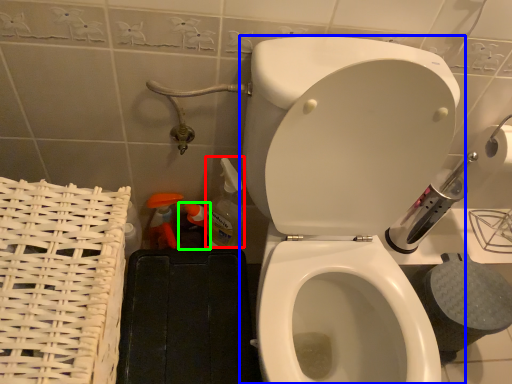
Question: Considering the real-world distances, which object is farthest from cleaning product (highlighted by a red box)? toilet (highlighted by a blue box) or cleaning product (highlighted by a green box)?

Choices:
 (A) toilet
 (B) cleaning product

Answer: (A)